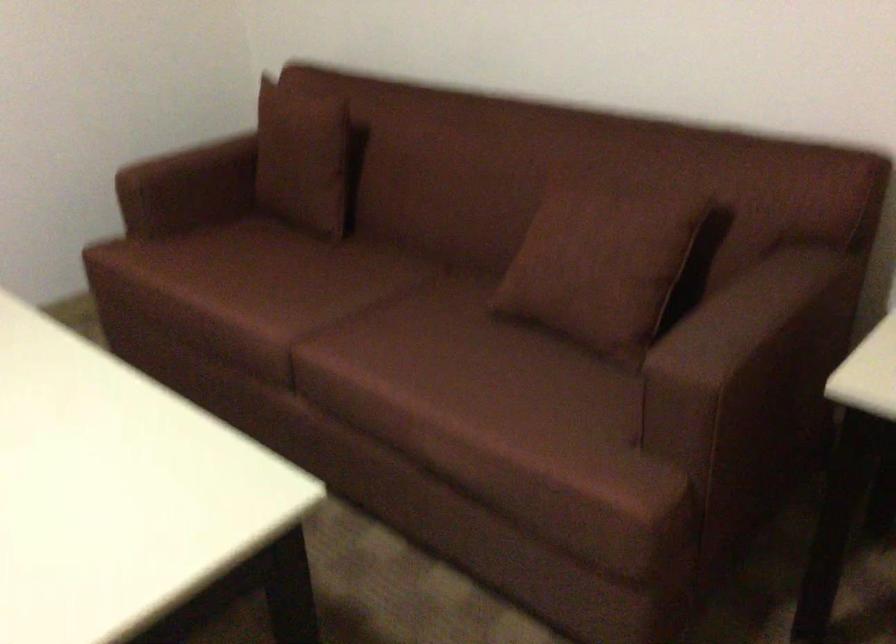
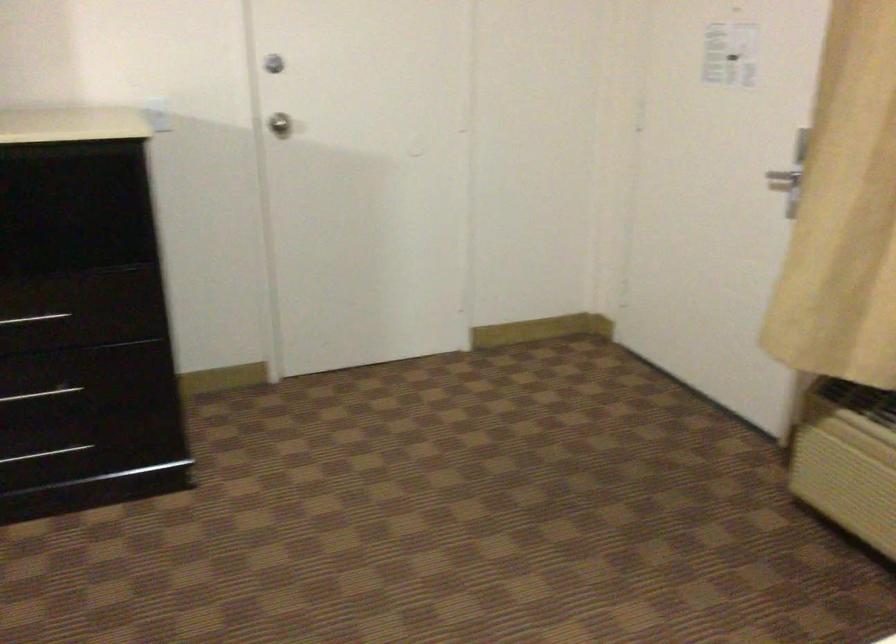
Based on the continuous images, in which direction is the camera rotating?

The camera's rotation is toward left-down.